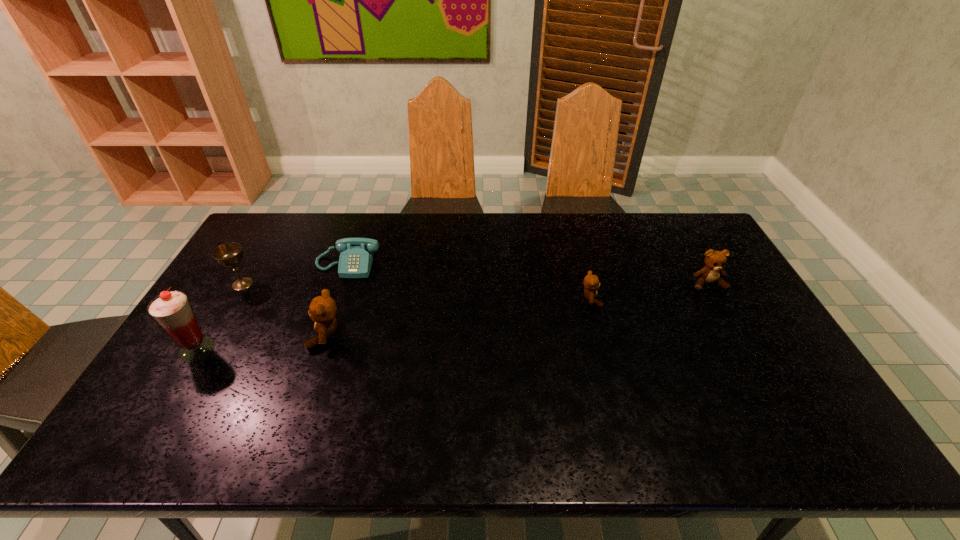
The image size is (960, 540). Identify the location of empty space that is in between the tallest teddy bear and the chalice. click(284, 309).

You are a GUI agent. You are given a task and a screenshot of the screen. Output one action in this format:
    pyautogui.click(x=<x>, y=<y>)
    Task: Click on the empty location between the rightmost teddy bear and the fifth tallest object
    The image size is (960, 540).
    Given the screenshot: What is the action you would take?
    pyautogui.click(x=649, y=292)

You are a GUI agent. You are given a task and a screenshot of the screen. Output one action in this format:
    pyautogui.click(x=<x>, y=<y>)
    Task: Click on the vacant space in between the rightmost teddy bear and the nearest teddy bear
    The width and height of the screenshot is (960, 540).
    Given the screenshot: What is the action you would take?
    pyautogui.click(x=517, y=309)

You are a GUI agent. You are given a task and a screenshot of the screen. Output one action in this format:
    pyautogui.click(x=<x>, y=<y>)
    Task: Click on the vacant area that lies between the shortest teddy bear and the tallest teddy bear
    
    Given the screenshot: What is the action you would take?
    pyautogui.click(x=459, y=317)

Identify the location of free spot between the telephone and the chalice. (295, 274).

Identify the location of the closest object to the chalice. (356, 256).

The image size is (960, 540). I want to click on object that stands as the fourth closest to the chalice, so click(x=591, y=282).

Identify the location of teddy bear that is the closest one to the leftmost teddy bear. This screenshot has width=960, height=540. (591, 282).

Identify the location of teddy bear that is the closest one to the leftmost teddy bear. This screenshot has width=960, height=540. (591, 282).

Locate an element on the screen. This screenshot has height=540, width=960. free spot that satisfies the following two spatial constraints: 1. on the front-facing side of the rightmost object; 2. on the front-facing side of the shortest teddy bear is located at coordinates (716, 299).